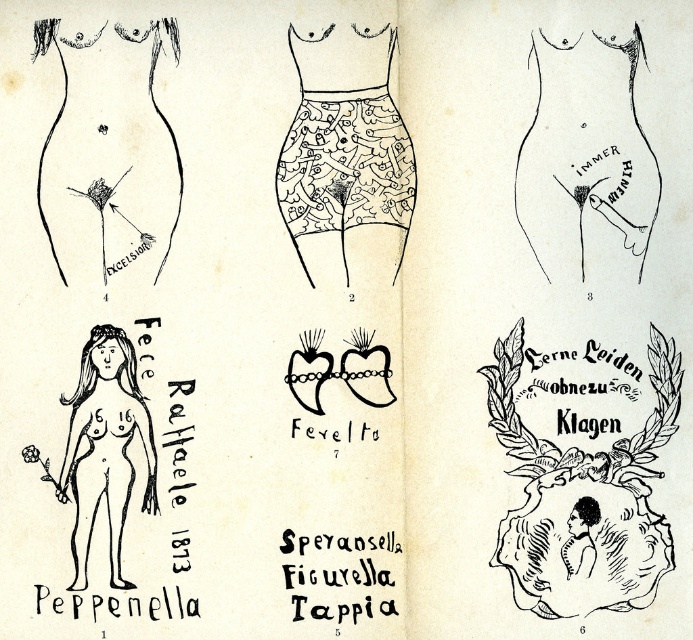
Question: Estimate the real-world distances between objects in this image. Which object is farther from the black line drawing nude woman at lower left?

Choices:
 (A) black ink drawing of torso at upper center
 (B) black lace bikini top at upper center
 (C) matte black underwear at lower left

Answer: (A)

Question: Which point is farther from the camera taking this photo?

Choices:
 (A) (82, 228)
 (B) (541, 230)
 (C) (389, 182)
 (D) (563, 556)

Answer: (C)

Question: Among these points, which one is nearest to the camera?

Choices:
 (A) (114, 248)
 (B) (602, 205)
 (C) (507, 412)
 (D) (333, 122)

Answer: (B)

Question: Observing the image, what is the correct spatial positioning of black ink drawing of torso at upper center in reference to black lace bikini top at upper center?

Choices:
 (A) below
 (B) above

Answer: (A)

Question: Does matte black underwear at lower left appear under black line drawing nude woman at lower left?

Choices:
 (A) yes
 (B) no

Answer: (B)

Question: Is matte black underwear at lower left positioned before black lace underwear at center?

Choices:
 (A) yes
 (B) no

Answer: (A)